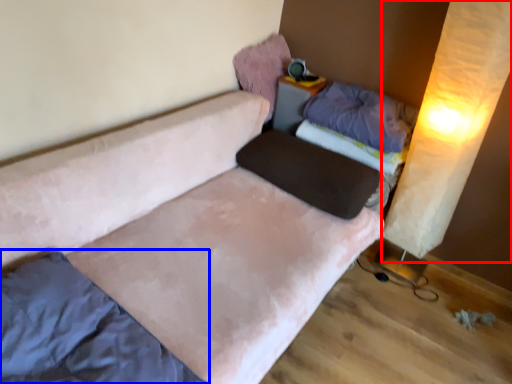
Question: Which of the following is the farthest to the observer, curtain (highlighted by a red box) or mattress (highlighted by a blue box)?

Choices:
 (A) curtain
 (B) mattress

Answer: (A)